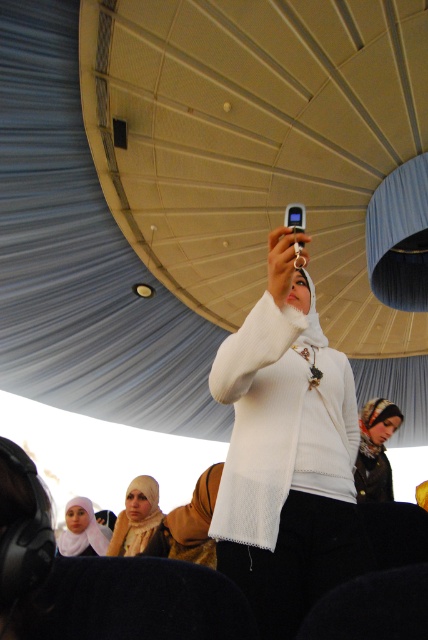
You are organizing a photoshoot and need to ensure that the white textured scarf at center and the matte white hijab at lower center are visible in the frame. Given their sizes, which one might require more space in the background to avoid being cropped?

The matte white hijab at lower center requires more space in the background since its width is greater than the white textured scarf at center.

You are a fashion designer observing the image and want to create a new scarf design. Which of the two items at the center, the white mesh scarf at center or the white sheer hijab at center, should you choose if you want to incorporate a larger size into your design?

The white mesh scarf at center is bigger than the white sheer hijab at center, so you should choose the white mesh scarf at center for a larger size design.

Where is the white textured scarf at center located in the image?

The white textured scarf at center is located at point (376,451) in the image.